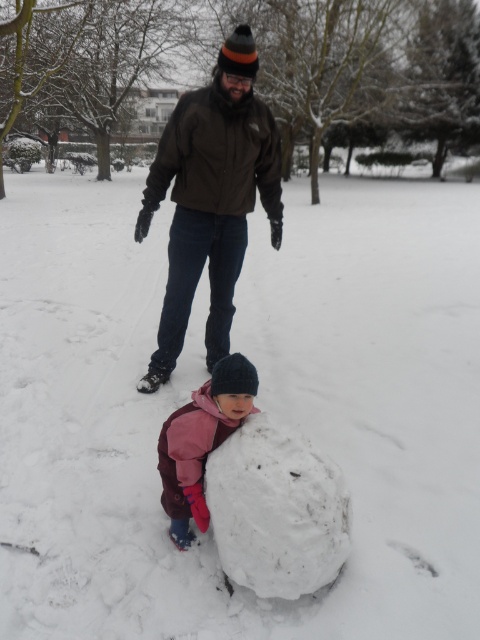
Which is in front, point (169, 138) or point (195, 156)?

Point (195, 156) is more forward.

Looking at this image, does dark brown jacket at center have a greater width compared to dark brown softshell jacket at center?

Correct, the width of dark brown jacket at center exceeds that of dark brown softshell jacket at center.

Between point (279, 198) and point (179, 204), which one is positioned in front?

Positioned in front is point (179, 204).

The height and width of the screenshot is (640, 480). I want to click on dark brown jacket at center, so click(x=211, y=198).

Based on the photo, how far apart are dark brown jacket at center and pink fleece jacket at center?

dark brown jacket at center and pink fleece jacket at center are 6.21 feet apart.

Does point (213, 260) come closer to viewer compared to point (183, 419)?

No, (213, 260) is behind (183, 419).

Between point (260, 193) and point (214, 401), which one is positioned behind?

The point (260, 193) is more distant.

Locate an element on the screen. The image size is (480, 640). dark brown jacket at center is located at coordinates (211, 198).

Can you confirm if dark brown softshell jacket at center is positioned above pink fleece jacket at center?

Yes, dark brown softshell jacket at center is above pink fleece jacket at center.

Where is `dark brown softshell jacket at center`? dark brown softshell jacket at center is located at coordinates (217, 154).

Which is in front, point (228, 109) or point (177, 445)?

Point (177, 445)

Find the location of a particular element. The width and height of the screenshot is (480, 640). dark brown softshell jacket at center is located at coordinates (217, 154).